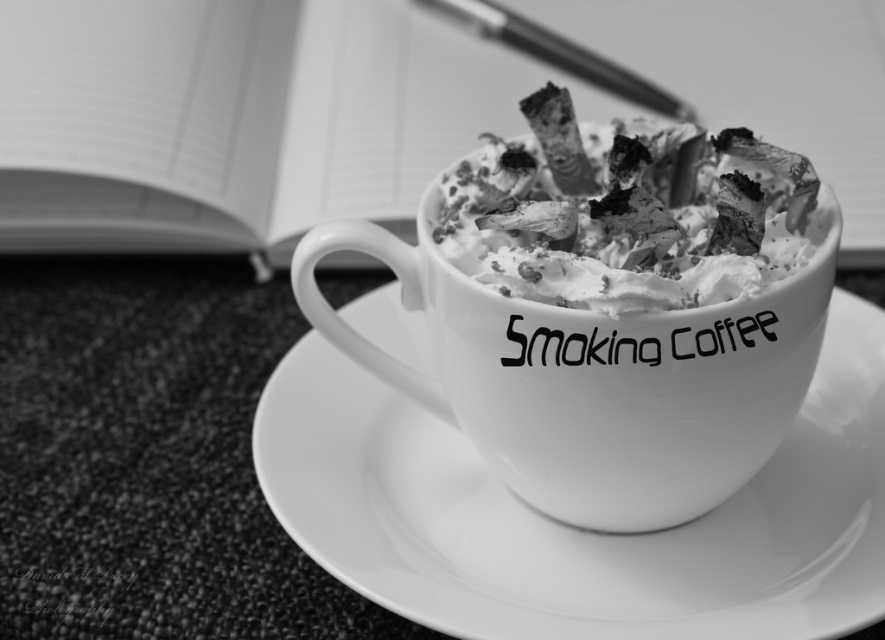
You are a barista trying to place a new coffee order on the counter. The customer wants their coffee placed exactly at the point labeled point (609, 308). Where should you place the coffee?

The point (609, 308) is on the white matte mug at center, so you should place the coffee on the white matte mug at center.